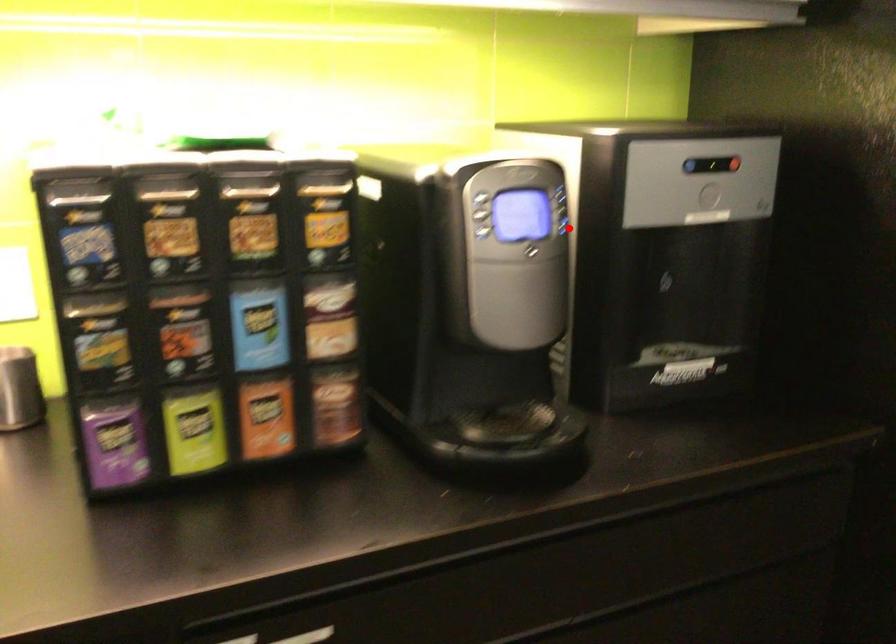
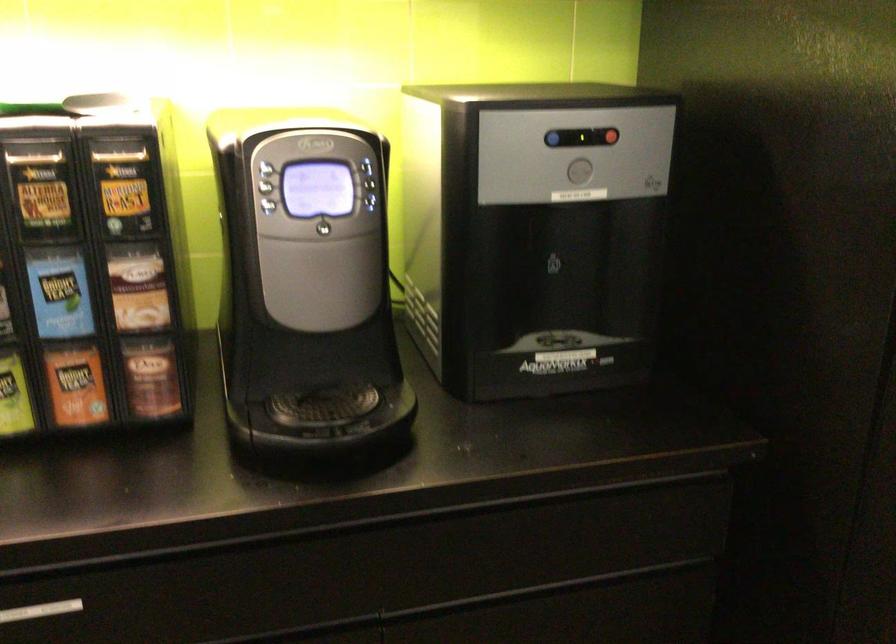
The point at the highlighted location is marked in the first image. Where is the corresponding point in the second image?

(375, 204)